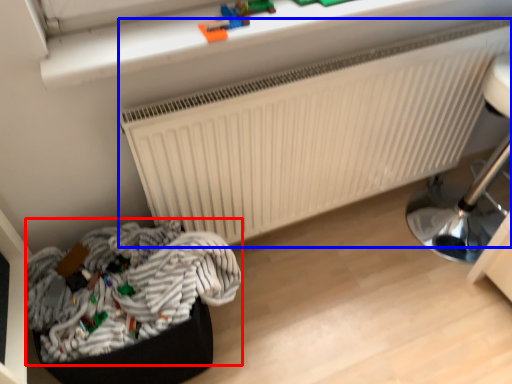
Question: Which object is closer to the camera taking this photo, laundry (highlighted by a red box) or radiator (highlighted by a blue box)?

Choices:
 (A) laundry
 (B) radiator

Answer: (A)